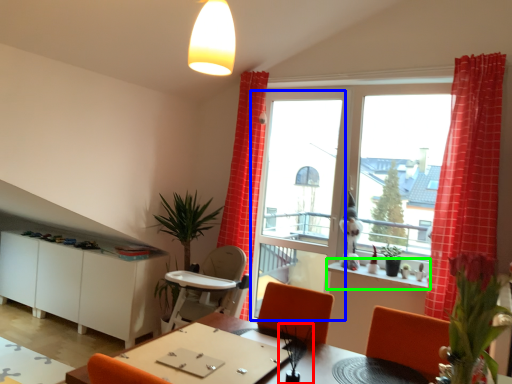
Question: Which object is the closest to the plant (highlighted by a red box)? Choose among these: screen door (highlighted by a blue box) or window sill (highlighted by a green box).

Choices:
 (A) screen door
 (B) window sill

Answer: (B)